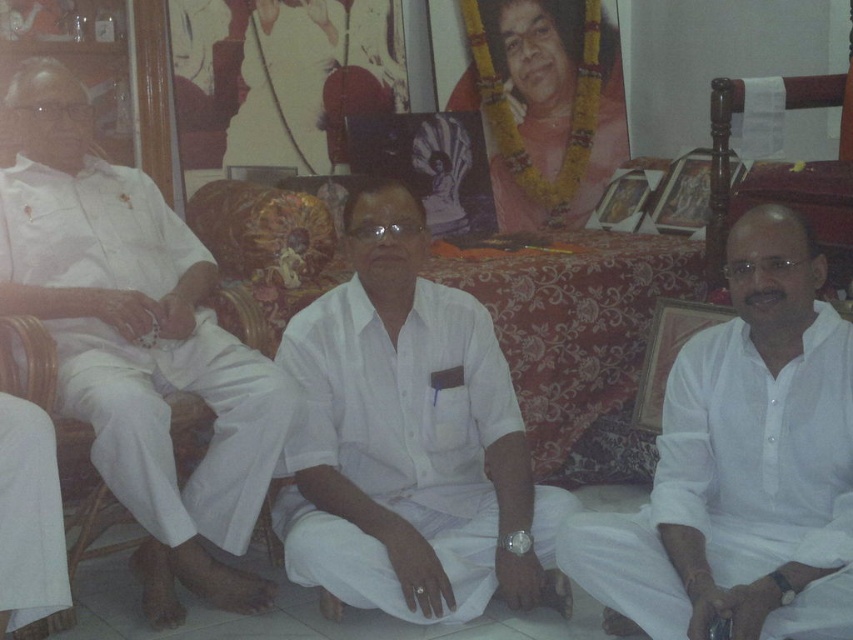
Based on the scene description, which object is located below the other between the white cotton shirt at center and the white cotton kurta at left?

The white cotton shirt at center is positioned under the white cotton kurta at left.

You are a photographer trying to capture a clear shot of the white cotton shirt at center and the white cotton kurta at left. Since both are white, you need to adjust your camera to focus on the one closer to you. Which one should you focus on?

The white cotton shirt at center is in front of the white cotton kurta at left, so you should focus on the white cotton shirt at center since it is closer to you.

Based on the scene description, where is the white cotton shirt at center located in terms of coordinates?

The white cotton shirt at center is located at coordinates point (408, 440).